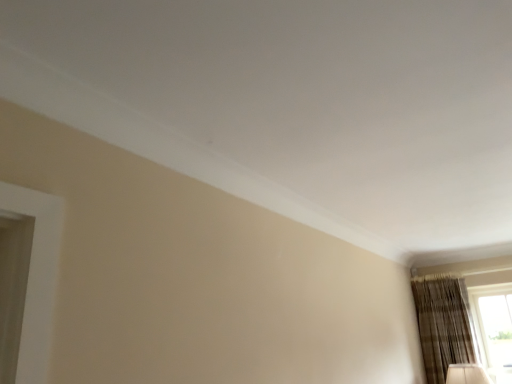
Locate an element on the screen. The width and height of the screenshot is (512, 384). transparent glass window at lower right is located at coordinates (494, 328).

This screenshot has height=384, width=512. What do you see at coordinates (494, 328) in the screenshot?
I see `transparent glass window at lower right` at bounding box center [494, 328].

Looking at this image, measure the distance between transparent glass window at lower right and camera.

transparent glass window at lower right is 3.48 meters from camera.

The width and height of the screenshot is (512, 384). What do you see at coordinates (443, 324) in the screenshot?
I see `brown textured curtain at lower right` at bounding box center [443, 324].

This screenshot has width=512, height=384. I want to click on brown textured curtain at lower right, so click(x=443, y=324).

This screenshot has width=512, height=384. Identify the location of transparent glass window at lower right. (494, 328).

Considering the relative positions of brown textured curtain at lower right and transparent glass window at lower right in the image provided, is brown textured curtain at lower right to the left or to the right of transparent glass window at lower right?

Based on their positions, brown textured curtain at lower right is located to the left of transparent glass window at lower right.

Is brown textured curtain at lower right further to camera compared to transparent glass window at lower right?

No, it is not.

Is point (471, 347) closer or farther from the camera than point (480, 293)?

Point (471, 347) is positioned closer to the camera compared to point (480, 293).

From the image's perspective, is brown textured curtain at lower right located above or below transparent glass window at lower right?

From the image's perspective, brown textured curtain at lower right appears above transparent glass window at lower right.

In the scene shown: From a real-world perspective, does brown textured curtain at lower right sit lower than transparent glass window at lower right?

Incorrect, from a real-world perspective, brown textured curtain at lower right is higher than transparent glass window at lower right.

Which of these two, brown textured curtain at lower right or transparent glass window at lower right, is thinner?

Thinner between the two is transparent glass window at lower right.

Is brown textured curtain at lower right taller or shorter than transparent glass window at lower right?

brown textured curtain at lower right is taller than transparent glass window at lower right.

Is brown textured curtain at lower right smaller than transparent glass window at lower right?

Actually, brown textured curtain at lower right might be larger than transparent glass window at lower right.

Is brown textured curtain at lower right surrounding transparent glass window at lower right?

No.

In the scene shown: Is brown textured curtain at lower right next to transparent glass window at lower right?

No, brown textured curtain at lower right is not next to transparent glass window at lower right.

Is brown textured curtain at lower right turned away from transparent glass window at lower right?

No.

How many degrees apart are the facing directions of brown textured curtain at lower right and transparent glass window at lower right?

The angular difference between brown textured curtain at lower right and transparent glass window at lower right is 1.1 degrees.

In order to click on curtain above the transparent glass window at lower right (from a real-world perspective) in this screenshot , I will do `click(443, 324)`.

Is transparent glass window at lower right to the right of brown textured curtain at lower right from the viewer's perspective?

Correct, you'll find transparent glass window at lower right to the right of brown textured curtain at lower right.

Which object is further away from the camera taking this photo, transparent glass window at lower right or brown textured curtain at lower right?

transparent glass window at lower right is behind.

Considering the positions of points (496, 352) and (438, 311), is point (496, 352) closer to camera compared to point (438, 311)?

No.

From the image's perspective, who appears lower, transparent glass window at lower right or brown textured curtain at lower right?

transparent glass window at lower right appears lower in the image.

From a real-world perspective, which is physically below, transparent glass window at lower right or brown textured curtain at lower right?

transparent glass window at lower right.

Which object is wider, transparent glass window at lower right or brown textured curtain at lower right?

brown textured curtain at lower right.

Considering the relative sizes of transparent glass window at lower right and brown textured curtain at lower right in the image provided, is transparent glass window at lower right taller than brown textured curtain at lower right?

No, transparent glass window at lower right is not taller than brown textured curtain at lower right.

Considering the sizes of objects transparent glass window at lower right and brown textured curtain at lower right in the image provided, who is smaller, transparent glass window at lower right or brown textured curtain at lower right?

With smaller size is transparent glass window at lower right.

Is transparent glass window at lower right outside of brown textured curtain at lower right?

transparent glass window at lower right is positioned outside brown textured curtain at lower right.

Is transparent glass window at lower right next to brown textured curtain at lower right and touching it?

No, transparent glass window at lower right is not making contact with brown textured curtain at lower right.

Consider the image. Is transparent glass window at lower right oriented away from brown textured curtain at lower right?

No, brown textured curtain at lower right is not at the back of transparent glass window at lower right.

There is a transparent glass window at lower right. Identify the location of curtain above it (from a real-world perspective). Image resolution: width=512 pixels, height=384 pixels. (443, 324).

The height and width of the screenshot is (384, 512). In order to click on curtain on the left of transparent glass window at lower right in this screenshot , I will do `click(443, 324)`.

Identify the location of window that appears behind the brown textured curtain at lower right. The width and height of the screenshot is (512, 384). (494, 328).